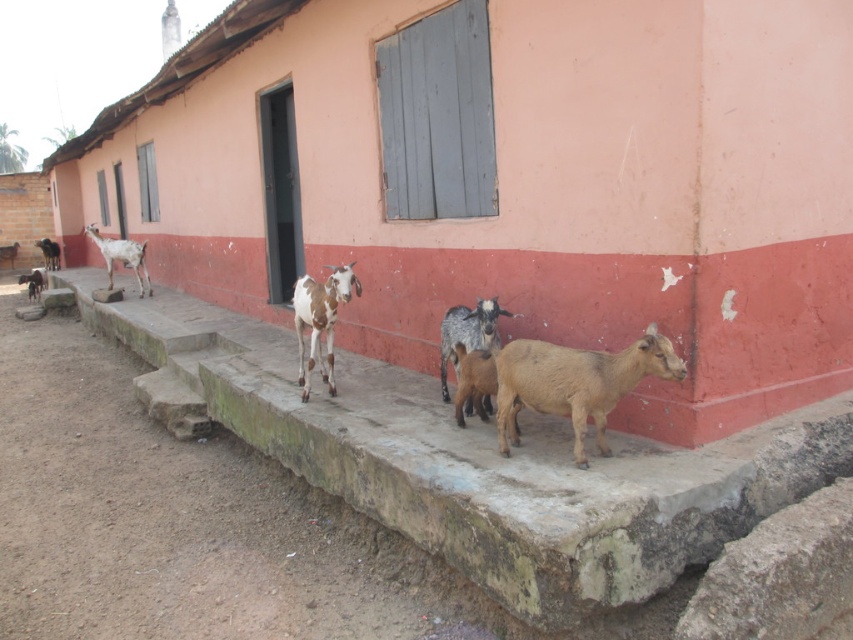
Question: Considering the real-world distances, which object is farthest from the brown speckled goat at lower left?

Choices:
 (A) white spotted fur goat at center
 (B) concrete ledge at center

Answer: (A)

Question: Does concrete ledge at center appear on the left side of white speckled fur goat at left?

Choices:
 (A) no
 (B) yes

Answer: (A)

Question: Is brown woolen goat at center behind white spotted fur goat at center?

Choices:
 (A) no
 (B) yes

Answer: (A)

Question: Which of the following is the farthest from the observer?

Choices:
 (A) (210, 326)
 (B) (316, 342)
 (C) (109, 266)
 (D) (517, 316)

Answer: (C)

Question: Which point is closer to the camera taking this photo?

Choices:
 (A) (485, 401)
 (B) (112, 285)

Answer: (A)

Question: Can you confirm if white spotted fur goat at center is smaller than brown speckled fur goat at center?

Choices:
 (A) no
 (B) yes

Answer: (A)